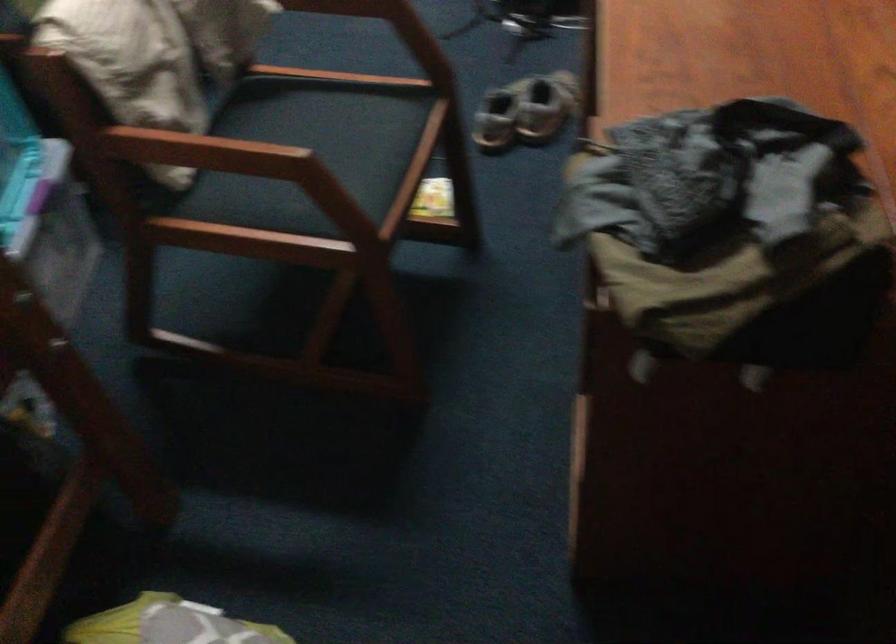
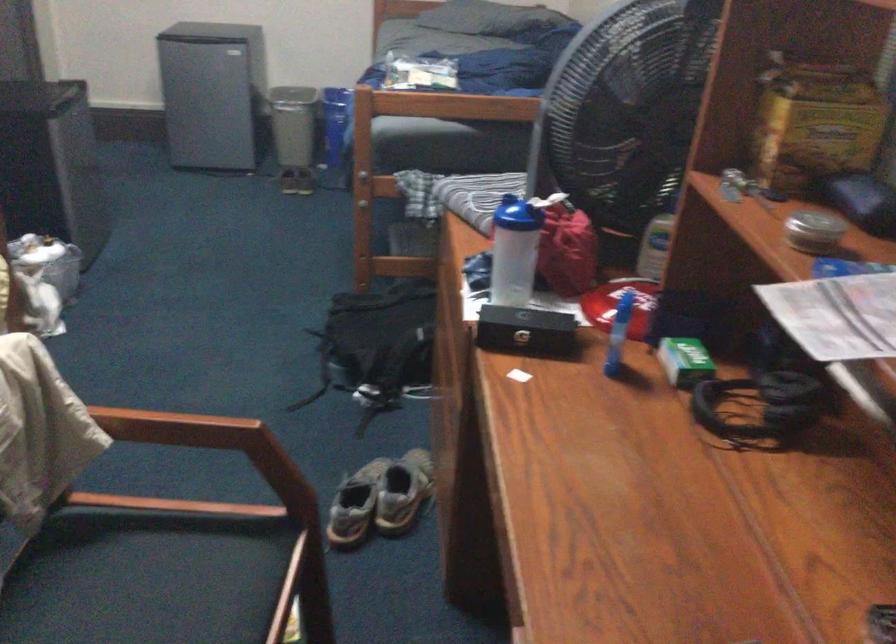
Where in the second image is the point corresponding to pixel 545 108 from the first image?

(402, 491)